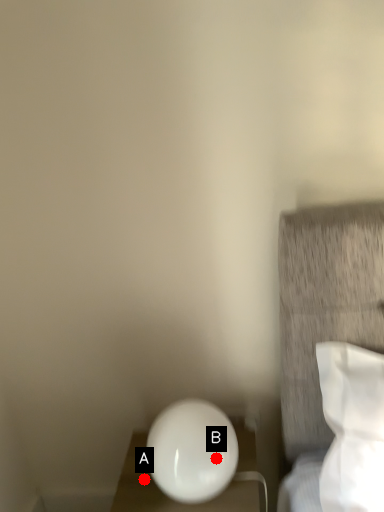
Question: Two points are circled on the image, labeled by A and B beside each circle. Which of the following is the farthest from the observer?

Choices:
 (A) A is further
 (B) B is further

Answer: (A)